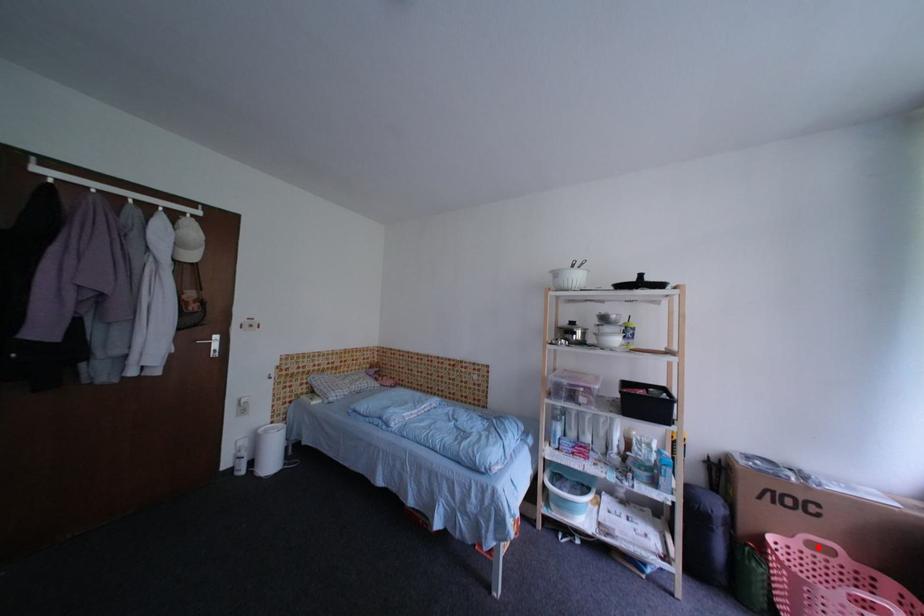
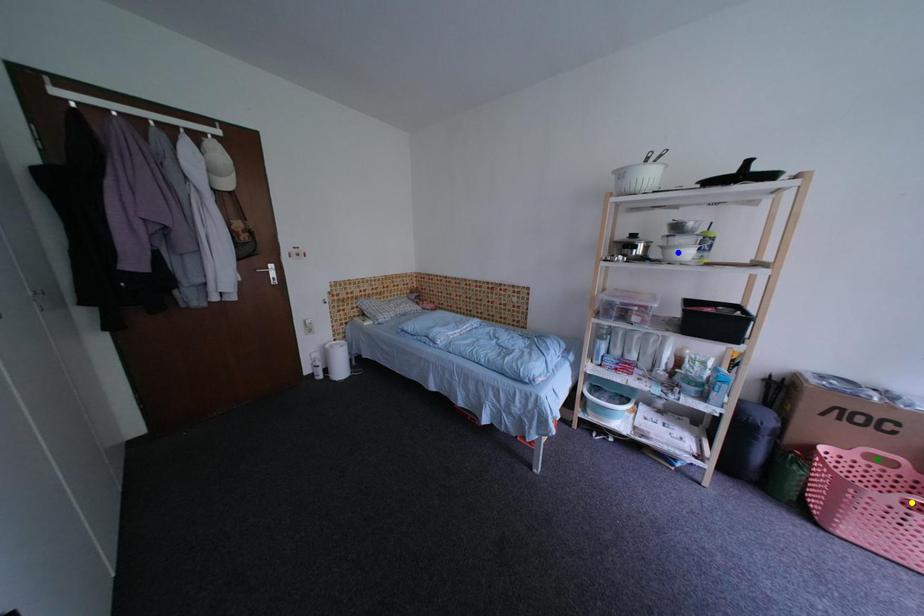
Question: I am providing you with two images of the same scene from different viewpoints. A red point is marked on the first image. You are given multiple points on the second image. Can you choose the point in image 2 that corresponds to the point in image 1?

Choices:
 (A) yellow point
 (B) green point
 (C) blue point

Answer: (B)